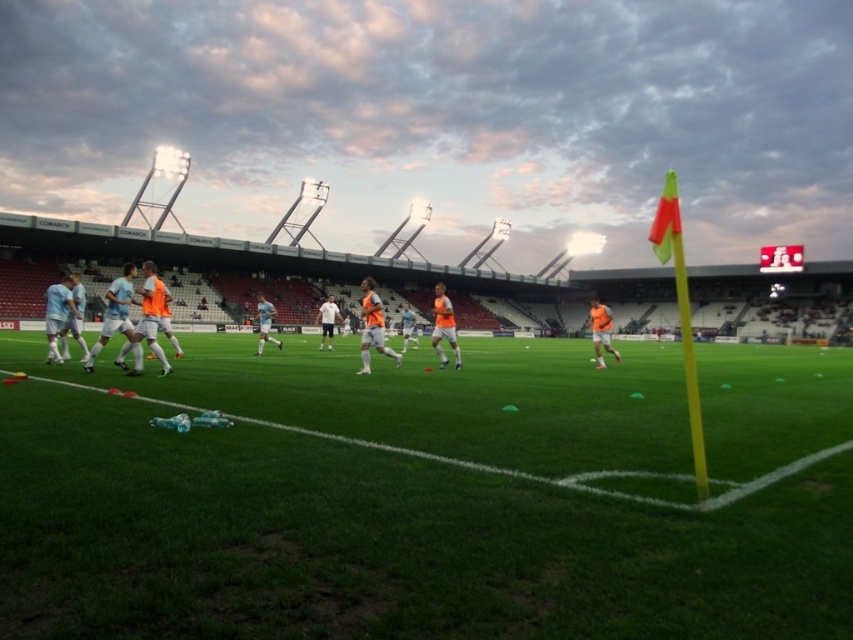
You are a coach observing the soccer training session. You notice the light blue fabric soccer players at left and the orange mesh vest at center. Which group is positioned to the left of the other?

The light blue fabric soccer players at left is positioned on the left side of orange mesh vest at center.

Consider the image. You are a coach observing the soccer training session. You notice the light blue fabric soccer players at left. Where exactly are they positioned on the field?

A: The light blue fabric soccer players at left are positioned at coordinates point [137,321].

You are a soccer coach observing the training session. You notice two points marked on the field at coordinates point (378,300) and point (439,356). Which point is closer to the goal located at the far end of the field?

Point (378,300) is in front of point (439,356), so it is closer to the goal located at the far end of the field.